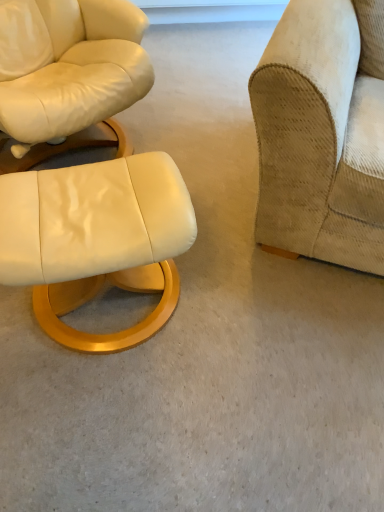
Question: Looking at the image, does beige corduroy couch at right seem bigger or smaller compared to matte white leather ottoman at lower left?

Choices:
 (A) small
 (B) big

Answer: (B)

Question: Is point (322, 201) positioned closer to the camera than point (178, 287)?

Choices:
 (A) farther
 (B) closer

Answer: (B)

Question: Is beige corduroy couch at right in front of or behind matte white leather ottoman at lower left in the image?

Choices:
 (A) front
 (B) behind

Answer: (A)

Question: Considering their positions, is matte white leather ottoman at lower left located in front of or behind beige corduroy couch at right?

Choices:
 (A) behind
 (B) front

Answer: (A)

Question: From their relative heights in the image, would you say matte white leather ottoman at lower left is taller or shorter than beige corduroy couch at right?

Choices:
 (A) short
 (B) tall

Answer: (A)

Question: Would you say matte white leather ottoman at lower left is to the left or to the right of beige corduroy couch at right in the picture?

Choices:
 (A) left
 (B) right

Answer: (A)

Question: Is matte white leather ottoman at lower left inside or outside of beige corduroy couch at right?

Choices:
 (A) inside
 (B) outside

Answer: (B)